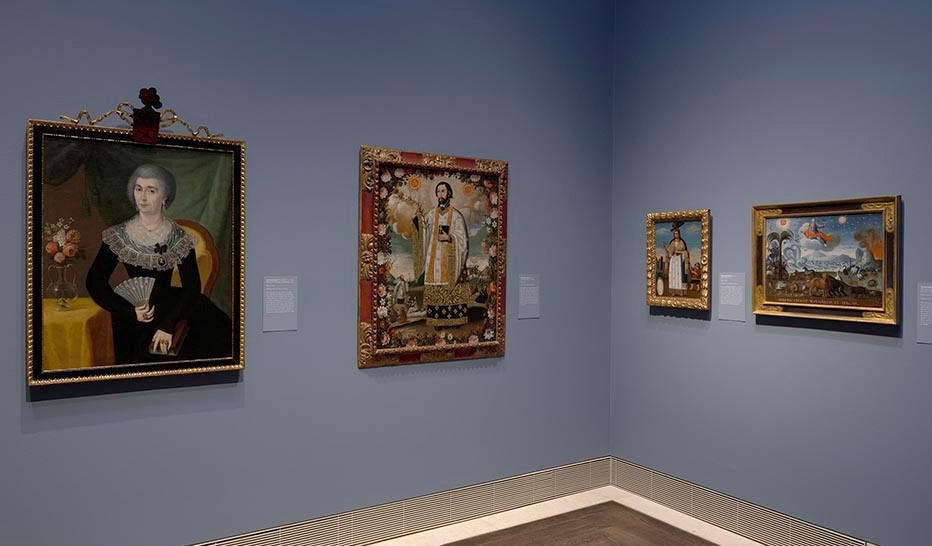
Locate an element on the screen. This screenshot has height=546, width=932. baseboard is located at coordinates (562, 505), (648, 509).